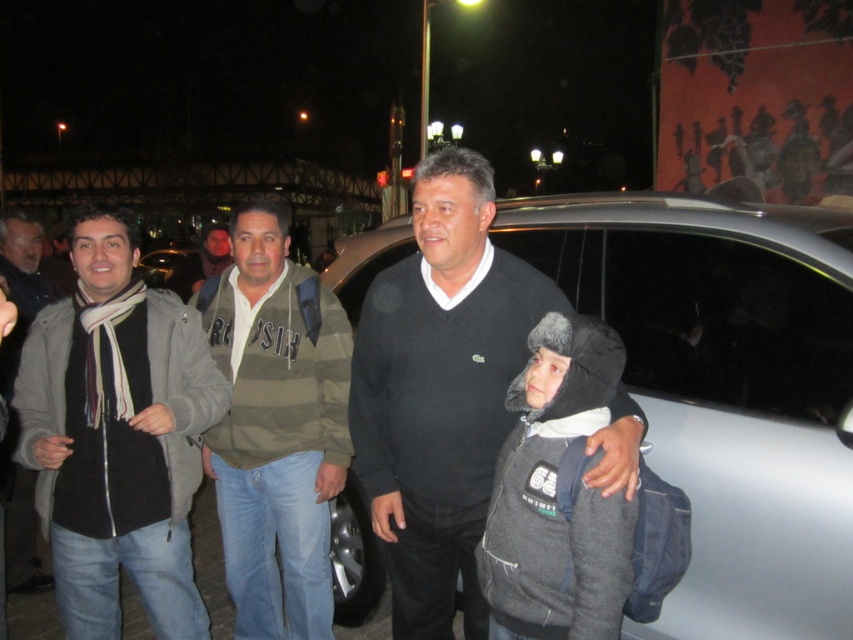
Question: Which point is farther to the camera?

Choices:
 (A) silver metallic car at center
 (B) striped fleece jacket at center
 (C) dark gray hoodie at center

Answer: (C)

Question: Can you confirm if silver metallic car at center is bigger than dark gray hoodie at center?

Choices:
 (A) no
 (B) yes

Answer: (B)

Question: Which point appears farthest from the camera in this image?

Choices:
 (A) (166, 589)
 (B) (3, 372)
 (C) (259, 332)

Answer: (B)

Question: Can you confirm if silver metallic car at center is positioned below dark gray fleece jacket at center?

Choices:
 (A) no
 (B) yes

Answer: (A)

Question: Does matte gray jacket at left come in front of black wool scarf at left?

Choices:
 (A) yes
 (B) no

Answer: (A)

Question: Which object appears farthest from the camera in this image?

Choices:
 (A) dark gray hoodie at center
 (B) matte gray jacket at left

Answer: (A)